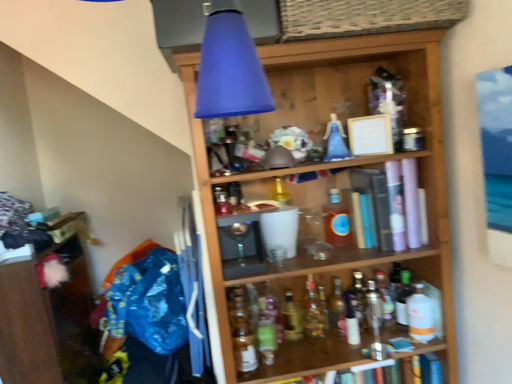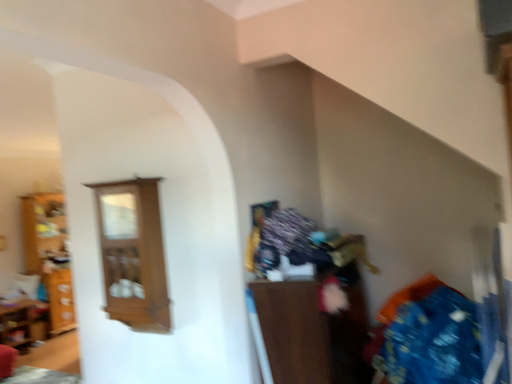
Question: How did the camera likely rotate when shooting the video?

Choices:
 (A) rotated right
 (B) rotated left

Answer: (B)